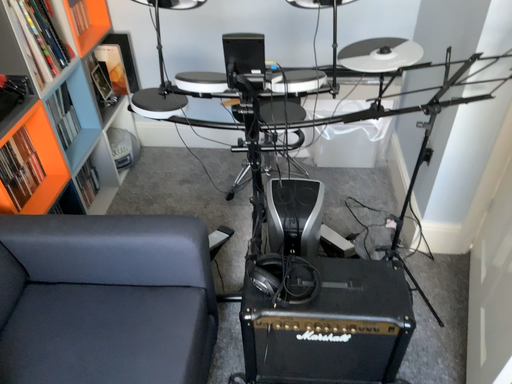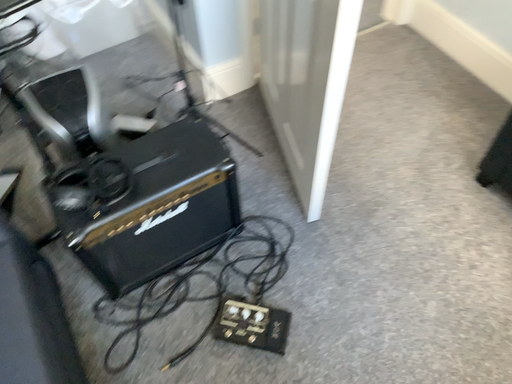
Question: Which way did the camera rotate in the video?

Choices:
 (A) rotated left
 (B) rotated right

Answer: (B)